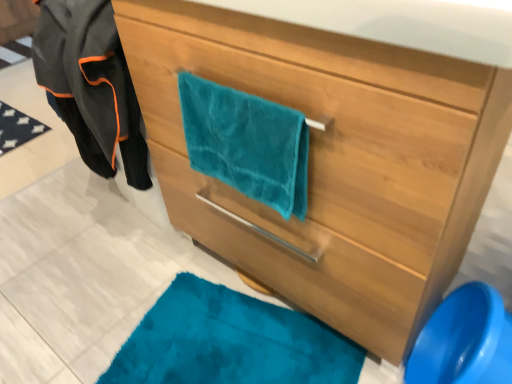
Locate an element on the screen. The height and width of the screenshot is (384, 512). teal plush towel at center is located at coordinates (246, 143).

In order to face teal fabric towel at center, should I rotate leftwards or rightwards?

To align with it, rotate left about 13.633°.

Find the location of a particular element. Image resolution: width=512 pixels, height=384 pixels. velvet black jacket at left is located at coordinates (91, 85).

Identify the location of teal plush towel at center. Image resolution: width=512 pixels, height=384 pixels. (246, 143).

How different are the orientations of teal fabric towel at center and velvet black jacket at left in degrees?

The angle between the facing direction of teal fabric towel at center and the facing direction of velvet black jacket at left is 89.7 degrees.

Considering the sizes of objects teal fabric towel at center and velvet black jacket at left in the image provided, who is bigger, teal fabric towel at center or velvet black jacket at left?

teal fabric towel at center is bigger.

From the image's perspective, is teal fabric towel at center positioned above or below velvet black jacket at left?

From the image's perspective, teal fabric towel at center appears below velvet black jacket at left.

Based on the photo, is teal fabric towel at center spatially inside velvet black jacket at left, or outside of it?

teal fabric towel at center cannot be found inside velvet black jacket at left.

Is teal fabric towel at center not close to teal fabric at lower right?

No, there isn't a large distance between teal fabric towel at center and teal fabric at lower right.

Consider the image. Is teal fabric towel at center to the left or to the right of teal fabric at lower right in the image?

Based on their positions, teal fabric towel at center is located to the left of teal fabric at lower right.

Is point (201, 239) in front of point (434, 380)?

No, it is not.

Find the location of a particular element. The width and height of the screenshot is (512, 384). drawer above the teal fabric at lower right (from the image's perspective) is located at coordinates (296, 258).

Between teal fabric at lower right and velvet black jacket at left, which one has smaller width?

teal fabric at lower right.

From a real-world perspective, is teal fabric at lower right on top of velvet black jacket at left?

Yes, from a real-world perspective, teal fabric at lower right is on top of velvet black jacket at left.

Is the position of teal fabric at lower right less distant than that of velvet black jacket at left?

Yes, the depth of teal fabric at lower right is less than that of velvet black jacket at left.

You are a GUI agent. You are given a task and a screenshot of the screen. Output one action in this format:
    pyautogui.click(x=<x>, y=<y>)
    Task: Click on the teal lying in front of the velvet black jacket at left
    The height and width of the screenshot is (384, 512).
    Given the screenshot: What is the action you would take?
    pyautogui.click(x=464, y=340)

Is point (140, 175) positioned in front of point (490, 297)?

That is False.

Can you tell me how much velvet black jacket at left and teal fabric at lower right differ in facing direction?

velvet black jacket at left and teal fabric at lower right are facing 92.7 degrees away from each other.

Is velvet black jacket at left bigger than teal fabric at lower right?

Actually, velvet black jacket at left might be smaller than teal fabric at lower right.

In the scene shown: From the image's perspective, would you say velvet black jacket at left is positioned over teal fabric at lower right?

Indeed, from the image's perspective, velvet black jacket at left is shown above teal fabric at lower right.

Is teal plush towel at center looking in the opposite direction of teal fabric towel at center?

No, teal plush towel at center's orientation is not away from teal fabric towel at center.

Is teal plush towel at center to the left of teal fabric towel at center from the viewer's perspective?

Incorrect, teal plush towel at center is not on the left side of teal fabric towel at center.

Which of these two, teal fabric towel at center or teal plush towel at center, is bigger?

teal fabric towel at center is bigger.

Is point (170, 205) closer or farther from the camera than point (302, 208)?

Clearly, point (170, 205) is more distant from the camera than point (302, 208).

Considering the relative positions of teal fabric towel at center and teal plush towel at center in the image provided, is teal fabric towel at center to the right of teal plush towel at center from the viewer's perspective?

In fact, teal fabric towel at center is to the left of teal plush towel at center.

Between teal plush towel at center and velvet black jacket at left, which one has larger size?

With larger size is velvet black jacket at left.

Which object is closer to the camera, teal plush towel at center or velvet black jacket at left?

Positioned in front is teal plush towel at center.

Considering the sizes of objects teal plush towel at center and velvet black jacket at left in the image provided, who is taller, teal plush towel at center or velvet black jacket at left?

teal plush towel at center is taller.

Is teal plush towel at center aimed at velvet black jacket at left?

No, teal plush towel at center is not aimed at velvet black jacket at left.

Locate an element on the screen. jacket on the left of teal fabric towel at center is located at coordinates (91, 85).

In order to click on drawer located above the teal fabric at lower right (from the image's perspective) in this screenshot , I will do `click(296, 258)`.

Considering their positions, is teal plush towel at center positioned closer to velvet black jacket at left than teal fabric at lower right?

Based on the image, teal plush towel at center appears to be nearer to velvet black jacket at left.

In the scene shown: When comparing their distances from teal fabric towel at center, does teal plush towel at center or teal fabric at lower right seem closer?

Based on the image, teal plush towel at center appears to be nearer to teal fabric towel at center.

Considering their positions, is teal fabric at lower right positioned further to teal fabric towel at center than teal plush towel at center?

teal fabric at lower right.

Looking at the image, which one is located closer to teal plush towel at center, velvet black jacket at left or teal fabric at lower right?

velvet black jacket at left is closer to teal plush towel at center.

Based on their spatial positions, is velvet black jacket at left or teal fabric at lower right closer to teal fabric towel at center?

velvet black jacket at left lies closer to teal fabric towel at center than the other object.

Estimate the real-world distances between objects in this image. Which object is closer to teal fabric at lower right, teal plush towel at center or velvet black jacket at left?

Based on the image, teal plush towel at center appears to be nearer to teal fabric at lower right.

Which object lies further to the anchor point teal fabric at lower right, velvet black jacket at left or teal plush towel at center?

velvet black jacket at left is further to teal fabric at lower right.

When comparing their distances from velvet black jacket at left, does teal fabric at lower right or teal fabric towel at center seem further?

Based on the image, teal fabric at lower right appears to be further to velvet black jacket at left.

Where is `drawer situated between velvet black jacket at left and teal plush towel at center from left to right`? This screenshot has height=384, width=512. drawer situated between velvet black jacket at left and teal plush towel at center from left to right is located at coordinates (296, 258).

This screenshot has width=512, height=384. I want to click on beach towel located between velvet black jacket at left and teal fabric at lower right in the left-right direction, so [x=246, y=143].

Identify the location of beach towel situated between teal fabric towel at center and teal fabric at lower right from left to right. The width and height of the screenshot is (512, 384). (246, 143).

You are a GUI agent. You are given a task and a screenshot of the screen. Output one action in this format:
    pyautogui.click(x=<x>, y=<y>)
    Task: Click on the drawer between velvet black jacket at left and teal fabric at lower right in the horizontal direction
    The width and height of the screenshot is (512, 384).
    Given the screenshot: What is the action you would take?
    pyautogui.click(x=296, y=258)